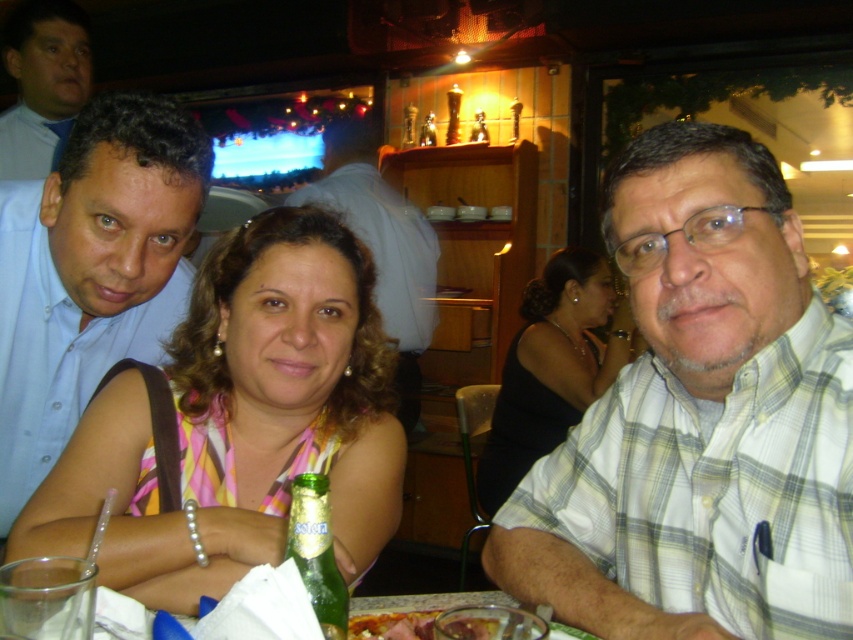
You are sitting at the table in the restaurant and want to pass a napkin from the point at coordinates point (758, 260) to the point at coordinates point (399, 198). Considering their positions, which point is closer to you?

Point (758, 260) is in front of point (399, 198), so the napkin should be passed from point (758, 260) to point (399, 198) since it is closer to you.

You are a photographer trying to capture the pink striped dress at center. Where should you position your camera relative to the individuals at the table to ensure the dress is in the frame?

The pink striped dress at center is located at point (241, 422), so positioning the camera to focus on that coordinate will ensure the dress is centered in the frame.

You are a photographer standing in front of the scene. You want to take a portrait of the pink striped dress at center. According to the guidelines, the ideal distance for a portrait is between 24 to 36 inches. Is your current position suitable for taking the portrait?

The pink striped dress at center and viewer are 29.12 inches apart. Since the ideal distance for a portrait is between 24 to 36 inches, the current position is suitable because 29.12 inches falls within that range.